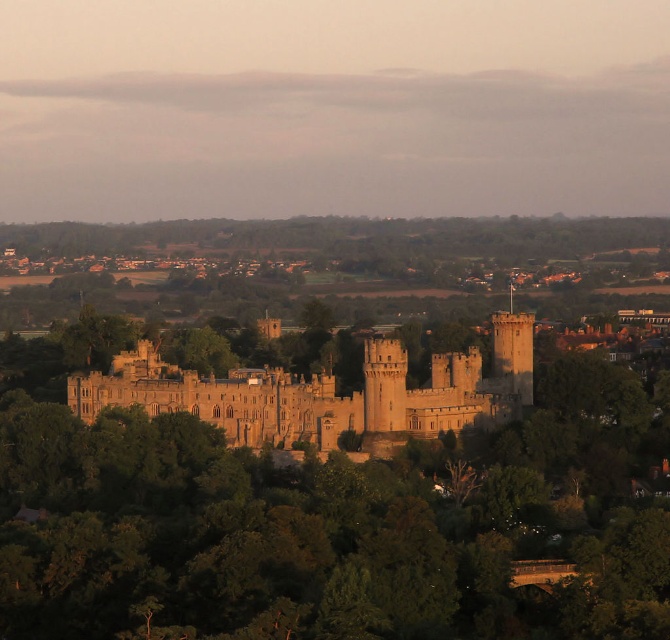
Looking at this image, you are a knight standing in the forest near the green leafy tree at center and the golden stone castle at center. Which object is taller from your viewpoint?

The green leafy tree at center is much taller than the golden stone castle at center.

You are an archer positioned behind the green leafy tree at center, aiming at an enemy on the golden stone castle at center. Which object is closer to you when you take your shot?

The green leafy tree at center is closer to you than the golden stone castle at center, so the tree is closer when you take your shot.

You are standing in front of the medieval castle and notice a green leafy tree at center. Based on its position, can you determine if the tree is closer to you or farther away compared to the castle walls?

The green leafy tree at center is located at point [328,493], which places it in the foreground, meaning it is closer to you than the castle walls.